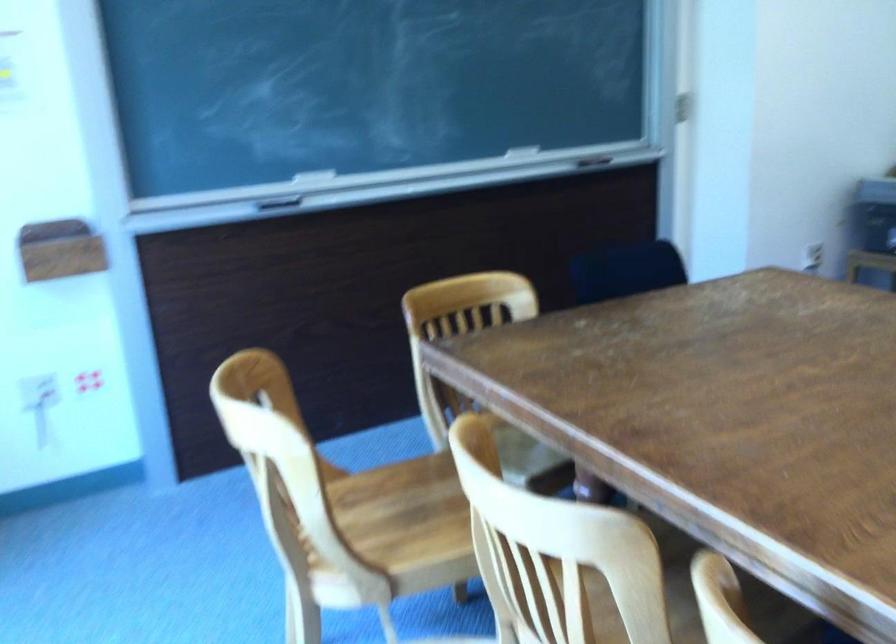
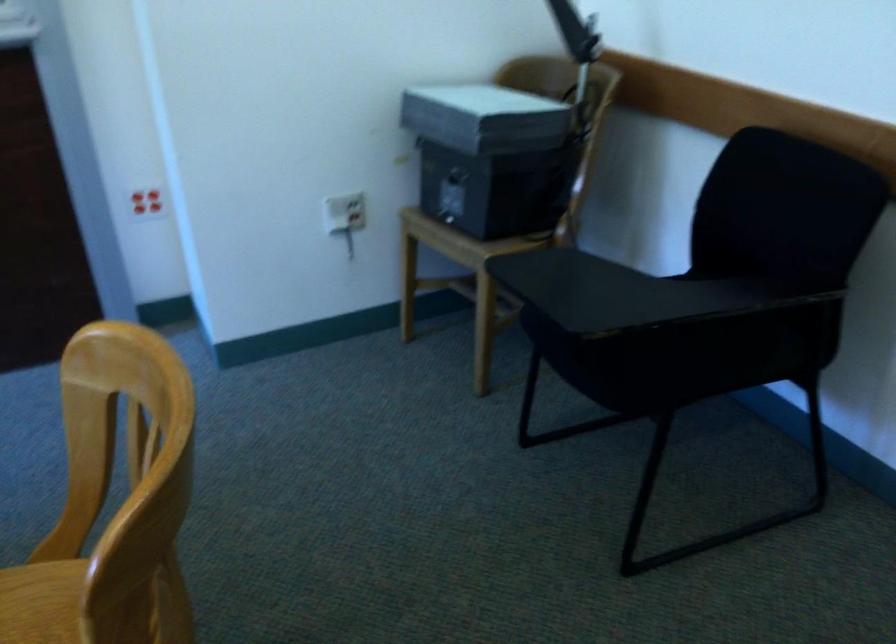
The images are taken continuously from a first-person perspective. In which direction are you moving?

The cameraman walked toward right, forward.